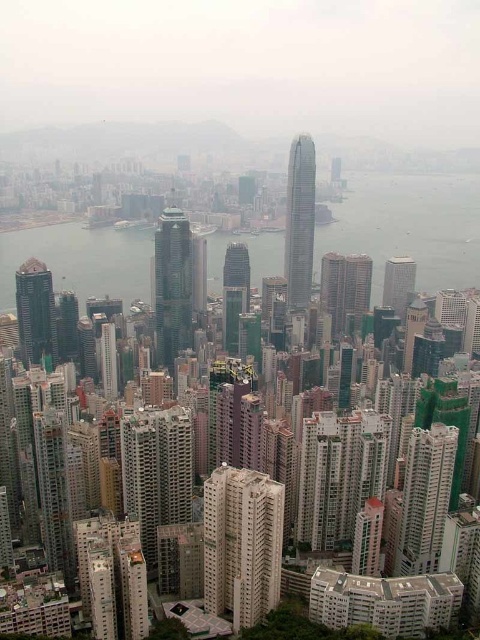
Which is behind, point (184, 307) or point (303, 234)?

Positioned behind is point (303, 234).

Can you confirm if green glass skyscraper at center is taller than glassy steel skyscraper at center?

In fact, green glass skyscraper at center may be shorter than glassy steel skyscraper at center.

Who is more forward, (166, 275) or (302, 280)?

Point (166, 275) is more forward.

Locate an element on the screen. green glass skyscraper at center is located at coordinates (171, 285).

Between beige concrete building at center and green glass skyscraper at center, which one is positioned lower?

Positioned lower is beige concrete building at center.

Between point (254, 538) and point (173, 278), which one is positioned in front?

Point (254, 538) is more forward.

Locate an element on the screen. Image resolution: width=480 pixels, height=640 pixels. beige concrete building at center is located at coordinates (241, 544).

Can you confirm if green glass skyscraper at center is shorter than smooth glass skyscraper at center?

No.

Where is `green glass skyscraper at center`? The image size is (480, 640). green glass skyscraper at center is located at coordinates (171, 285).

Measure the distance between point [190,330] and camera.

They are 1591.83 feet apart.

The image size is (480, 640). What are the coordinates of `green glass skyscraper at center` in the screenshot? It's located at (171, 285).